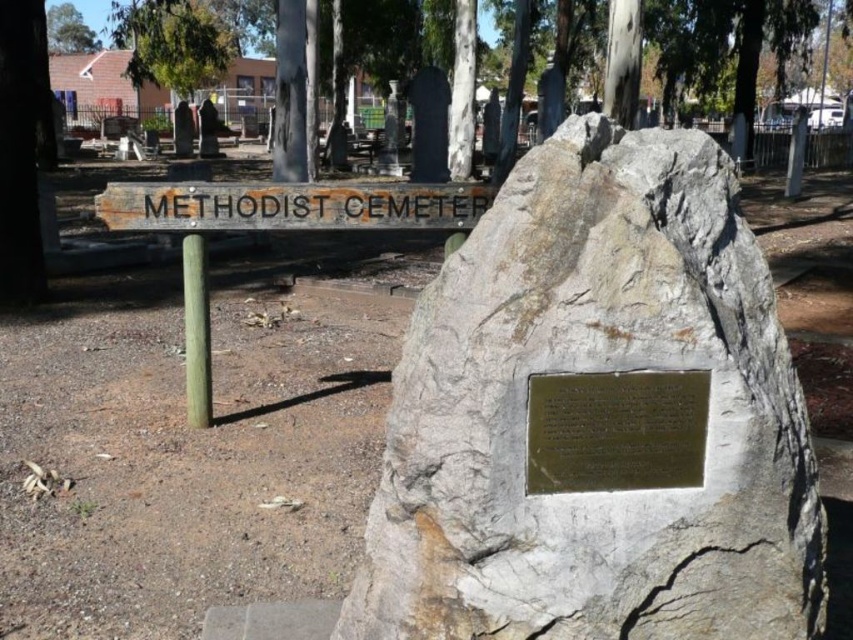
Is gray stone boulder at center thinner than green leafy tree at upper left?

Yes.

This screenshot has width=853, height=640. What do you see at coordinates (595, 378) in the screenshot?
I see `gray stone boulder at center` at bounding box center [595, 378].

Locate an element on the screen. This screenshot has height=640, width=853. gray stone boulder at center is located at coordinates tap(595, 378).

Is bronze plaque at center taller than rusty wood sign at center?

In fact, bronze plaque at center may be shorter than rusty wood sign at center.

Is point (573, 417) farther from viewer compared to point (263, 216)?

No, it is in front of (263, 216).

Describe the element at coordinates (614, 429) in the screenshot. I see `bronze plaque at center` at that location.

Find the location of `bronze plaque at center`. bronze plaque at center is located at coordinates (614, 429).

Can you confirm if bronze plaque at center is shorter than green leafy tree at upper left?

Correct, bronze plaque at center is not as tall as green leafy tree at upper left.

Does bronze plaque at center have a greater height compared to green leafy tree at upper left?

In fact, bronze plaque at center may be shorter than green leafy tree at upper left.

The height and width of the screenshot is (640, 853). I want to click on bronze plaque at center, so click(614, 429).